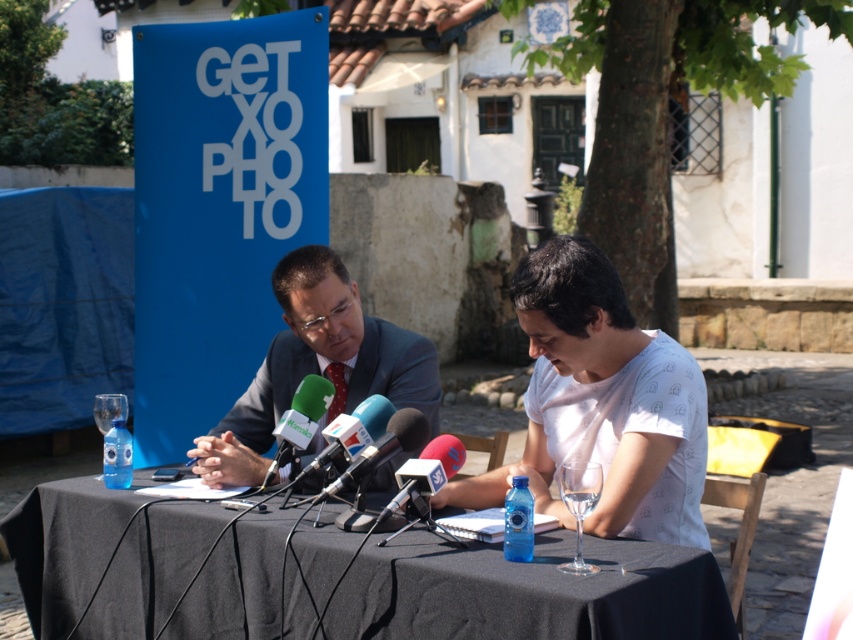
You are a photographer at the press conference. You need to adjust your camera angle so that both the black fabric table at center and the white cotton shirt at center are visible in the frame. Which object should you lower your camera angle to focus on, and which should you raise it for?

Since the black fabric table at center is shorter than the white cotton shirt at center, you should lower your camera angle to focus on the black fabric table at center and raise it to focus on the white cotton shirt at center.

You are a photographer setting up for an outdoor event. You have a camera tripod that requires a minimum of 1 meter of space between the black fabric table at center and the white cotton shirt at center to avoid blocking the shot. Based on the scene description, can you confirm if there is enough space between them?

The black fabric table at center might be wider than white cotton shirt at center, but the exact distance between them isn not specified. Therefore, it is uncertain whether there is enough space for the tripod.

You are a photographer at the press conference. You need to position your camera so that the black fabric table at center and the green fabric microphone at center are both in frame. According to the scene description, which object should you focus on first to ensure both are visible?

The black fabric table at center is below the green fabric microphone at center. Therefore, you should focus on the green fabric microphone at center first, as it is higher up, allowing the table to naturally come into view below it.